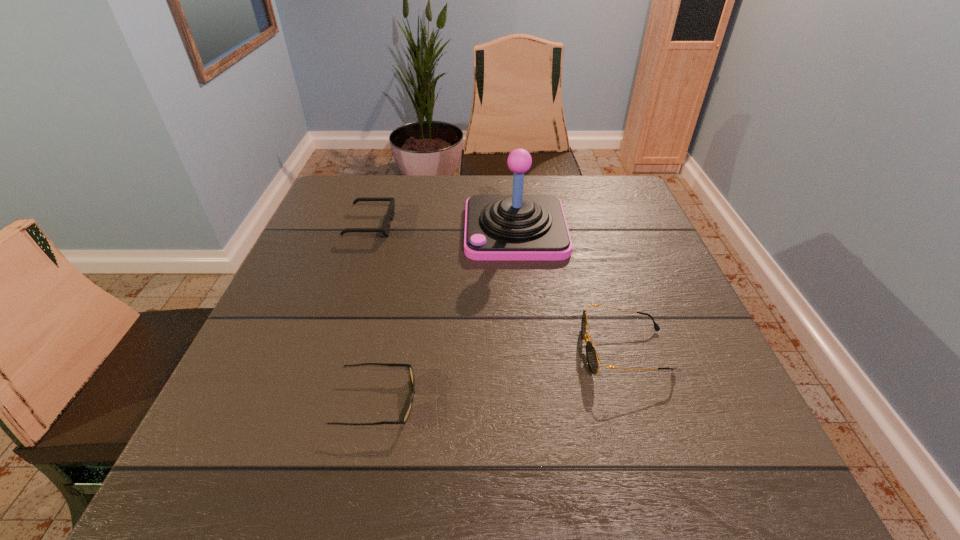
The image size is (960, 540). Identify the location of the tallest object. (517, 227).

The height and width of the screenshot is (540, 960). I want to click on the tallest sunglasses, so click(x=592, y=358).

This screenshot has width=960, height=540. Identify the location of the second tallest object. (592, 358).

This screenshot has height=540, width=960. What are the coordinates of `the farthest sunglasses` in the screenshot? It's located at [385, 230].

Image resolution: width=960 pixels, height=540 pixels. I want to click on free space located forward from the base of the joystick, so click(345, 230).

Locate an element on the screen. vacant space situated 0.190m forward from the base of the joystick is located at coordinates (392, 230).

You are a GUI agent. You are given a task and a screenshot of the screen. Output one action in this format:
    pyautogui.click(x=<x>, y=<y>)
    Task: Click on the free space located 0.070m forward from the base of the joystick
    Image resolution: width=960 pixels, height=540 pixels.
    Given the screenshot: What is the action you would take?
    pyautogui.click(x=438, y=230)

This screenshot has width=960, height=540. Identify the location of vacant space located 0.320m on the front-facing side of the tallest sunglasses. (413, 350).

This screenshot has height=540, width=960. Identify the location of vacant area located on the front-facing side of the tallest sunglasses. (471, 350).

Locate an element on the screen. This screenshot has width=960, height=540. vacant space located on the front-facing side of the tallest sunglasses is located at coordinates (397, 350).